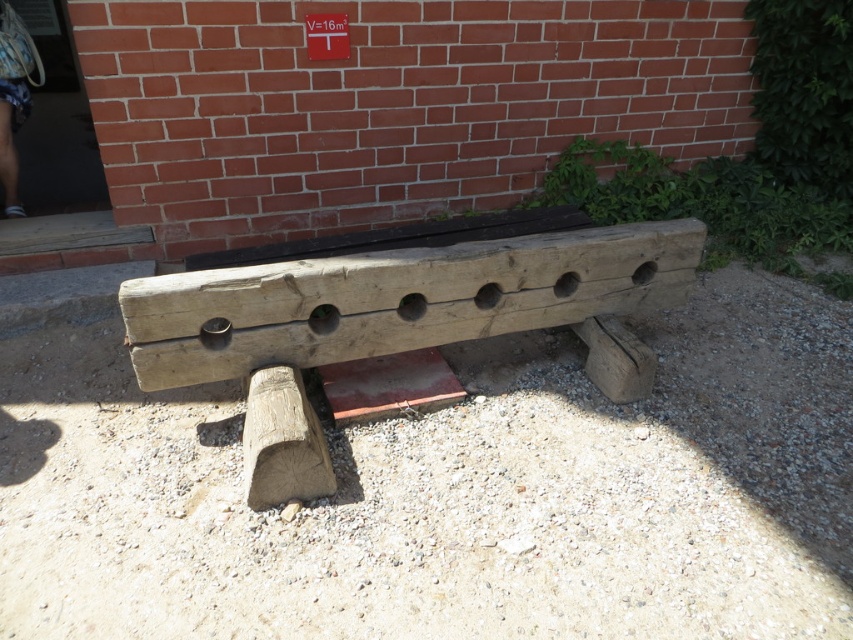
Question: Does natural stone gravel at center have a larger size compared to natural wood bench at center?

Choices:
 (A) no
 (B) yes

Answer: (B)

Question: Which of the following is the farthest from the observer?

Choices:
 (A) natural wood bench at center
 (B) natural stone gravel at center

Answer: (A)

Question: Can you confirm if natural stone gravel at center is bigger than natural wood bench at center?

Choices:
 (A) no
 (B) yes

Answer: (B)

Question: Is natural stone gravel at center thinner than natural wood bench at center?

Choices:
 (A) yes
 (B) no

Answer: (B)